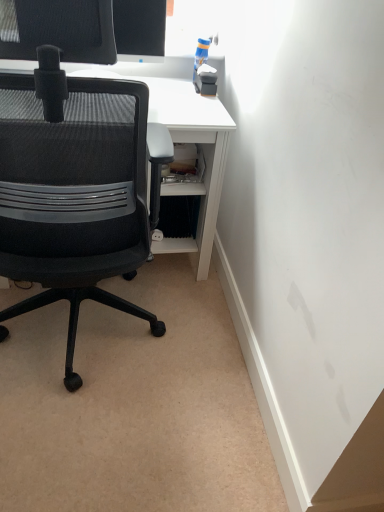
The width and height of the screenshot is (384, 512). What do you see at coordinates (72, 190) in the screenshot? I see `black mesh chair at left` at bounding box center [72, 190].

Find the location of a particular element. The width and height of the screenshot is (384, 512). black mesh chair at left is located at coordinates (72, 190).

You are a GUI agent. You are given a task and a screenshot of the screen. Output one action in this format:
    pyautogui.click(x=<x>, y=<y>)
    Task: Click on the black mesh chair at left
    The height and width of the screenshot is (512, 384).
    Given the screenshot: What is the action you would take?
    pyautogui.click(x=72, y=190)